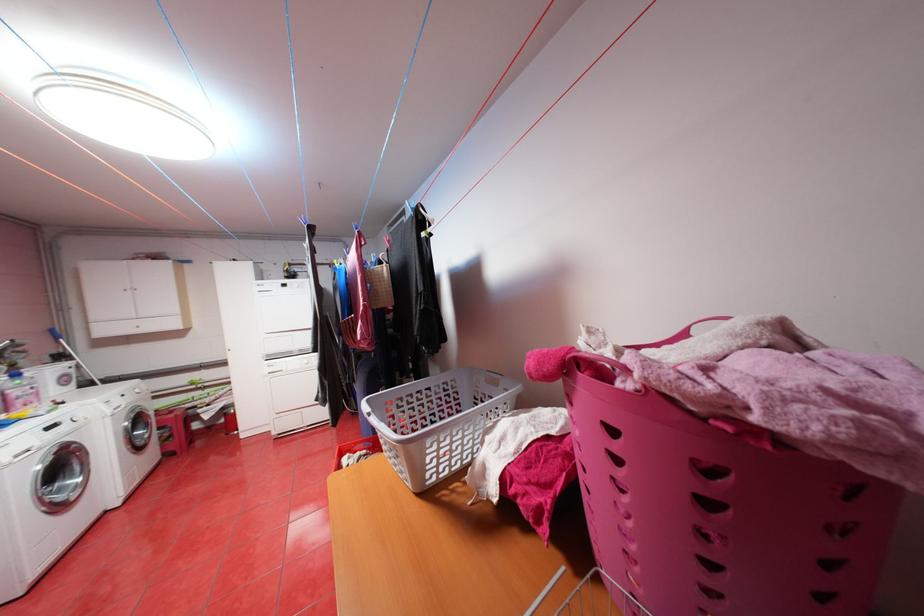
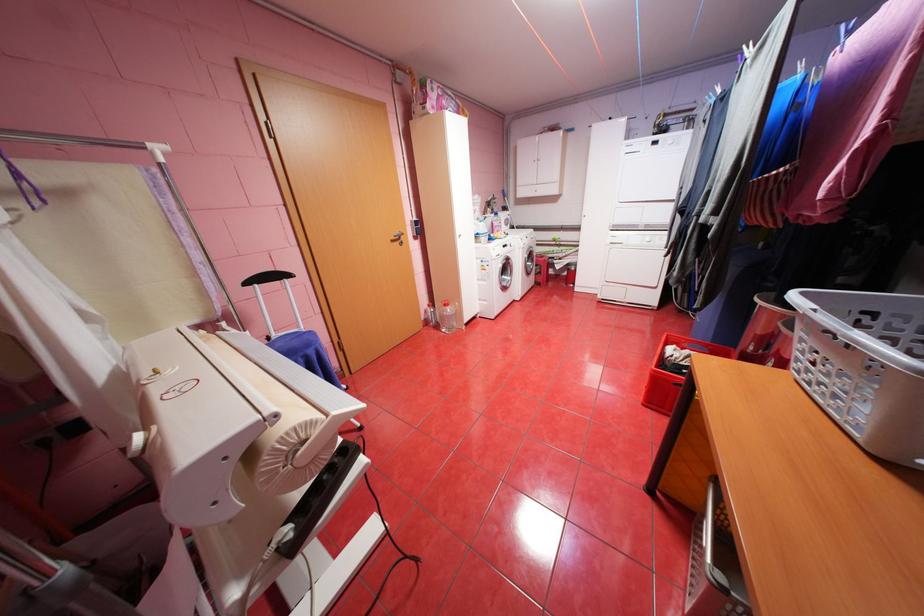
The point at (377, 399) is marked in the first image. Where is the corresponding point in the second image?

(811, 293)